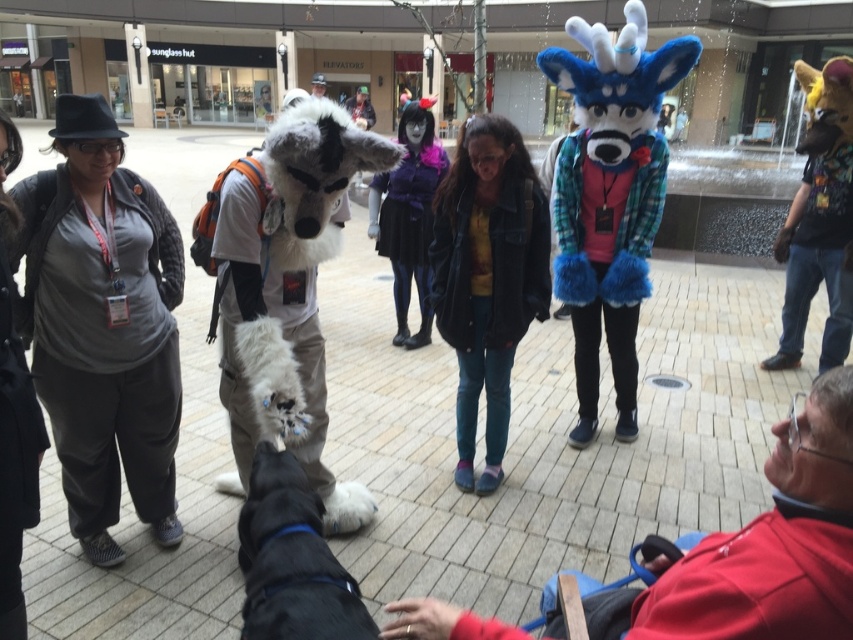
You are a photographer setting up a tripod in the center of the scene. You need to position it so that it doesn not block the denim jacket at center or the velvet blue plush at lower right. Given that the tripod has a base diameter of 30 cm, can you fit it in the space between them?

The denim jacket at center might be wider than velvet blue plush at lower right, so it is uncertain if the tripod can fit. You should check the actual width difference between them before deciding.

You are a photographer standing in the plaza and want to take a photo of the velvet blue plush at lower right and the matte black hat at upper left. Which object should you focus on first if you want to capture both in one shot without moving the camera?

The velvet blue plush at lower right is shorter than the matte black hat at upper left, so you should focus on the matte black hat at upper left first as it is taller and will require adjusting the camera angle to include both in the frame.

You are a photographer standing at the camera position. You want to take a photo of both the point at point (724, 625) and the point at point (312, 74). Which point will appear larger in the photo?

Point (724, 625) will appear larger in the photo because it is closer to the camera than point (312, 74).